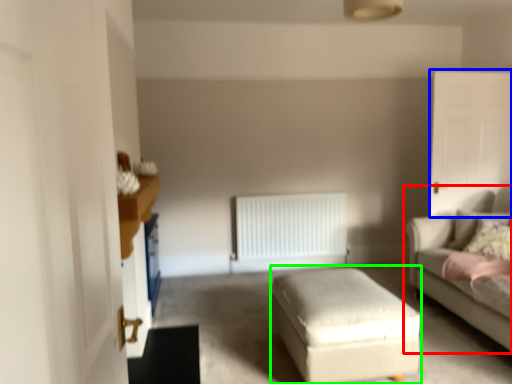
Question: Which object is the farthest from studio couch (highlighted by a red box)? Choose among these: glass door (highlighted by a blue box) or stool (highlighted by a green box).

Choices:
 (A) glass door
 (B) stool

Answer: (B)